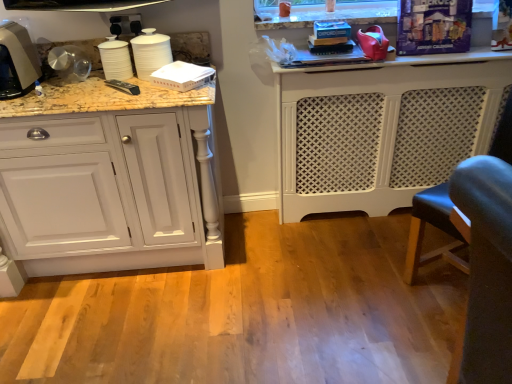
Question: Is matte gray cabinet at left, arranged as the 2th cabinetry when viewed from the right, located outside rubberized red shoe at upper right, which ranks as the 1th appliance in right-to-left order?

Choices:
 (A) yes
 (B) no

Answer: (A)

Question: Is matte gray cabinet at left, acting as the first cabinetry starting from the left, at the left side of rubberized red shoe at upper right, which ranks as the 1th appliance in right-to-left order?

Choices:
 (A) yes
 (B) no

Answer: (A)

Question: Does matte gray cabinet at left, arranged as the 2th cabinetry when viewed from the right, touch rubberized red shoe at upper right, which is the 4th appliance from left to right?

Choices:
 (A) no
 (B) yes

Answer: (A)

Question: From a real-world perspective, is matte gray cabinet at left, acting as the first cabinetry starting from the left, below rubberized red shoe at upper right, which ranks as the 1th appliance in right-to-left order?

Choices:
 (A) no
 (B) yes

Answer: (B)

Question: Is matte gray cabinet at left, arranged as the 2th cabinetry when viewed from the right, not close to rubberized red shoe at upper right, which is the 4th appliance from left to right?

Choices:
 (A) yes
 (B) no

Answer: (A)

Question: From a real-world perspective, is matte gray cabinet at left, acting as the first cabinetry starting from the left, physically above rubberized red shoe at upper right, which ranks as the 1th appliance in right-to-left order?

Choices:
 (A) yes
 (B) no

Answer: (B)

Question: Considering the relative sizes of white textured radiator at center, which appears as the first cabinetry when viewed from the right, and rubberized red shoe at upper right, which ranks as the 1th appliance in right-to-left order, in the image provided, is white textured radiator at center, which appears as the first cabinetry when viewed from the right, smaller than rubberized red shoe at upper right, which ranks as the 1th appliance in right-to-left order,?

Choices:
 (A) yes
 (B) no

Answer: (B)

Question: Does white textured radiator at center, which appears as the first cabinetry when viewed from the right, lie in front of rubberized red shoe at upper right, which ranks as the 1th appliance in right-to-left order?

Choices:
 (A) yes
 (B) no

Answer: (B)

Question: Considering the relative sizes of white textured radiator at center, which appears as the first cabinetry when viewed from the right, and rubberized red shoe at upper right, which is the 4th appliance from left to right, in the image provided, is white textured radiator at center, which appears as the first cabinetry when viewed from the right, thinner than rubberized red shoe at upper right, which is the 4th appliance from left to right,?

Choices:
 (A) no
 (B) yes

Answer: (A)

Question: Is white textured radiator at center, which appears as the first cabinetry when viewed from the right, beside rubberized red shoe at upper right, which ranks as the 1th appliance in right-to-left order?

Choices:
 (A) yes
 (B) no

Answer: (B)

Question: Can you confirm if white textured radiator at center, which appears as the first cabinetry when viewed from the right, is shorter than rubberized red shoe at upper right, which is the 4th appliance from left to right?

Choices:
 (A) yes
 (B) no

Answer: (B)

Question: Does white textured radiator at center, which is counted as the second cabinetry, starting from the left, appear on the left side of rubberized red shoe at upper right, which is the 4th appliance from left to right?

Choices:
 (A) no
 (B) yes

Answer: (A)

Question: Is metallic silver kettle at left not close to white glossy cups at upper left, the 2th appliance positioned from the left?

Choices:
 (A) no
 (B) yes

Answer: (A)